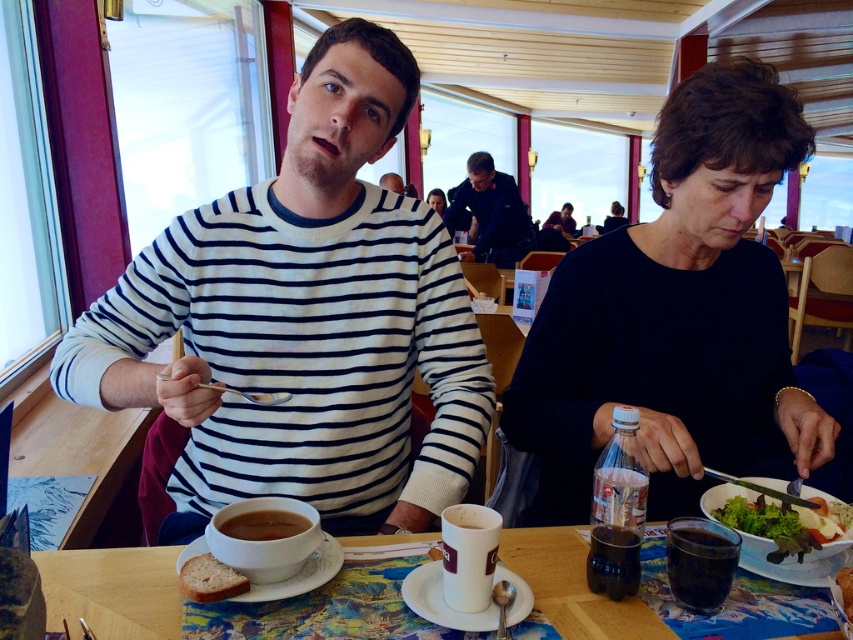
Question: Based on their relative distances, which object is farther from the matte striped shirt at center?

Choices:
 (A) white ceramic plate at lower left
 (B) white ceramic plate at center
 (C) white ceramic mug at center
 (D) black matte shirt at center

Answer: (B)

Question: Does white ceramic plate at lower left lie in front of golden crispy bread at center?

Choices:
 (A) no
 (B) yes

Answer: (A)

Question: Considering the relative positions of white ceramic plate at lower left and matte striped shirt at center in the image provided, where is white ceramic plate at lower left located with respect to matte striped shirt at center?

Choices:
 (A) below
 (B) above

Answer: (A)

Question: Which object is the farthest from the green leafy salad at lower right?

Choices:
 (A) brown matte cup at lower center
 (B) white ceramic plate at lower left

Answer: (A)

Question: Can you confirm if striped cotton sweater at center is positioned to the right of white ceramic plate at center?

Choices:
 (A) no
 (B) yes

Answer: (A)

Question: Which is farther from the brown matte cup at lower center?

Choices:
 (A) white ceramic plate at center
 (B) green leafy salad at lower right
 (C) white ceramic plate at lower left

Answer: (B)